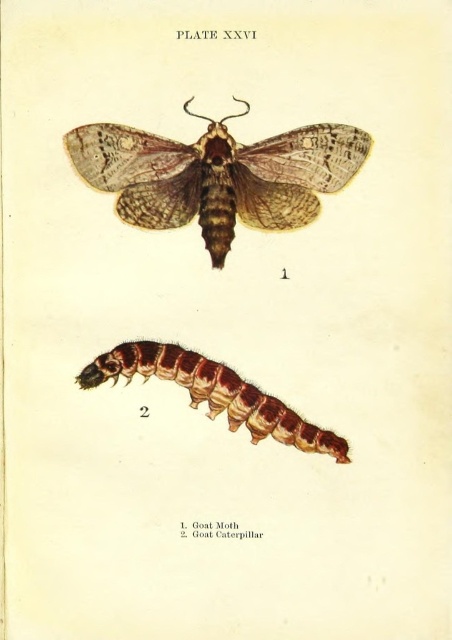
Question: Can you confirm if brown textured moth at upper center is bigger than brown fuzzy caterpillar at lower center?

Choices:
 (A) yes
 (B) no

Answer: (A)

Question: Is brown textured moth at upper center behind brown fuzzy caterpillar at lower center?

Choices:
 (A) yes
 (B) no

Answer: (B)

Question: Can you confirm if brown textured moth at upper center is positioned below brown fuzzy caterpillar at lower center?

Choices:
 (A) no
 (B) yes

Answer: (A)

Question: Which point is closer to the camera?

Choices:
 (A) (292, 412)
 (B) (192, 157)

Answer: (B)